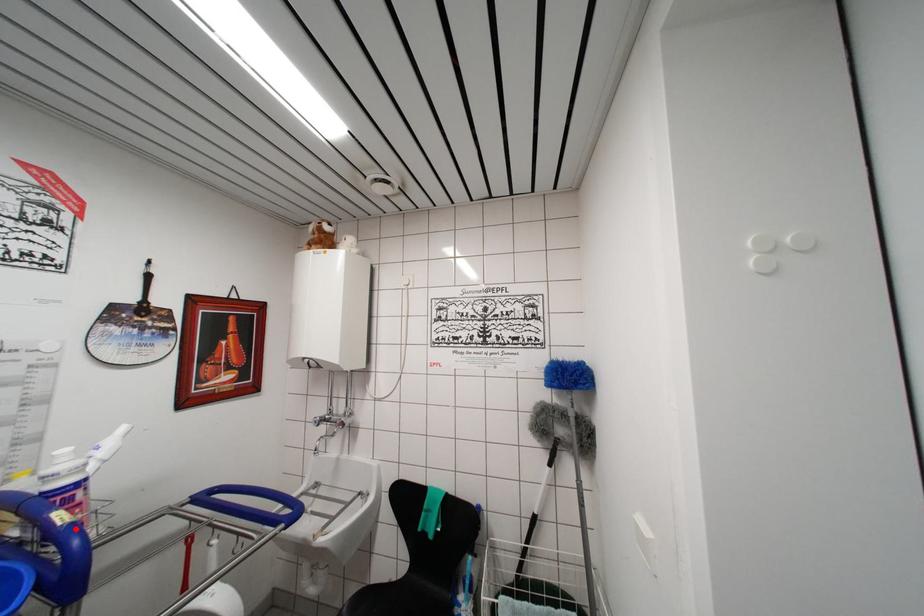
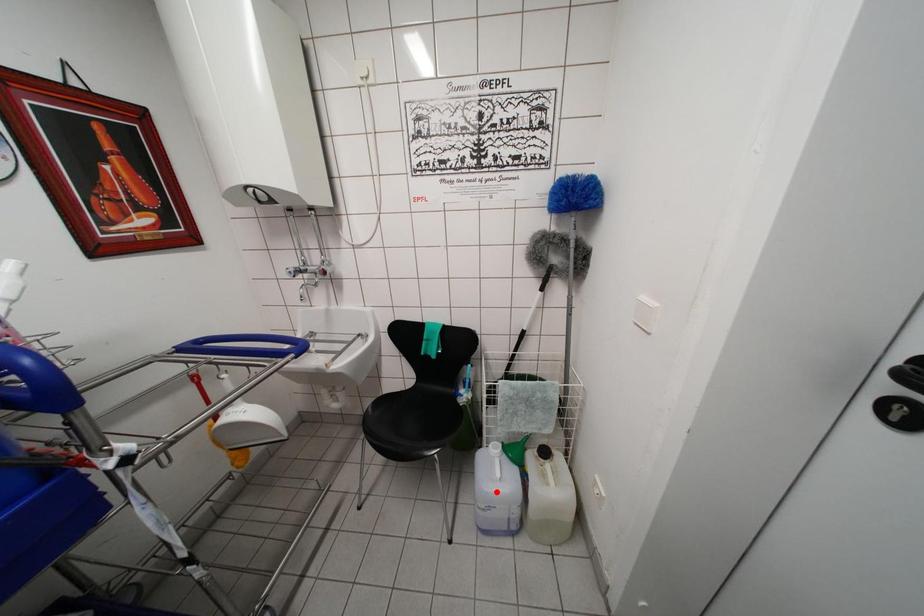
I am providing you with two images of the same scene from different viewpoints. A red point is marked on the first image and another point is marked on the second image. Does the point marked in image1 correspond to the same location as the one in image2?

No